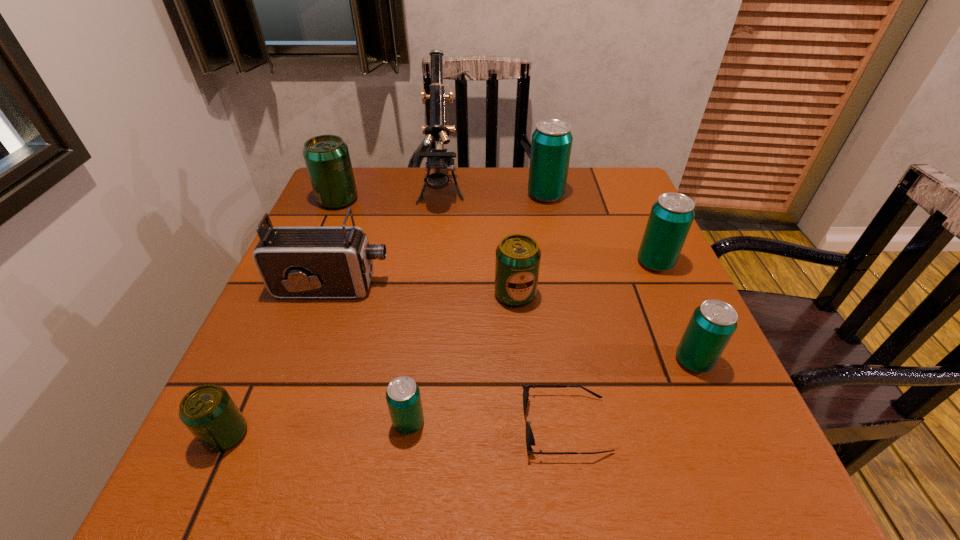
I want to click on free point located on the back of the fourth farthest beer can, so click(511, 243).

Image resolution: width=960 pixels, height=540 pixels. I want to click on free spot located 0.050m on the left of the second smallest teal beer can, so click(648, 361).

Find the location of a particular element. This screenshot has width=960, height=540. vacant space located 0.140m on the right of the nearest teal beer can is located at coordinates (511, 423).

At what (x,y) coordinates should I click in order to perform the action: click on free space located 0.100m on the right of the nearest green beer can. Please return your answer as a coordinate pair (x, y). Looking at the image, I should click on (310, 435).

Locate an element on the screen. vacant point located on the front-facing side of the shortest object is located at coordinates (487, 425).

At what (x,y) coordinates should I click in order to perform the action: click on vacant point located on the front-facing side of the shortest object. Please return your answer as a coordinate pair (x, y). Image resolution: width=960 pixels, height=540 pixels. Looking at the image, I should click on (320, 425).

You are a GUI agent. You are given a task and a screenshot of the screen. Output one action in this format:
    pyautogui.click(x=<x>, y=<y>)
    Task: Click on the vacant space located 0.340m on the front-facing side of the shortest object
    This screenshot has width=960, height=540.
    Given the screenshot: What is the action you would take?
    pyautogui.click(x=314, y=425)

At what (x,y) coordinates should I click in order to perform the action: click on microscope present at the far edge. Please return your answer as a coordinate pair (x, y). The height and width of the screenshot is (540, 960). Looking at the image, I should click on (437, 158).

The image size is (960, 540). Find the location of `beer can located in the near edge section of the desktop`. beer can located in the near edge section of the desktop is located at coordinates click(x=208, y=411).

Identify the location of sunglasses situated at the near edge. The width and height of the screenshot is (960, 540). (530, 441).